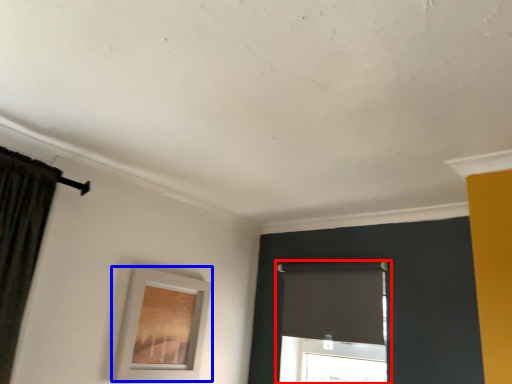
Question: Which object appears farthest to the camera in this image, window (highlighted by a red box) or picture frame (highlighted by a blue box)?

Choices:
 (A) window
 (B) picture frame

Answer: (A)